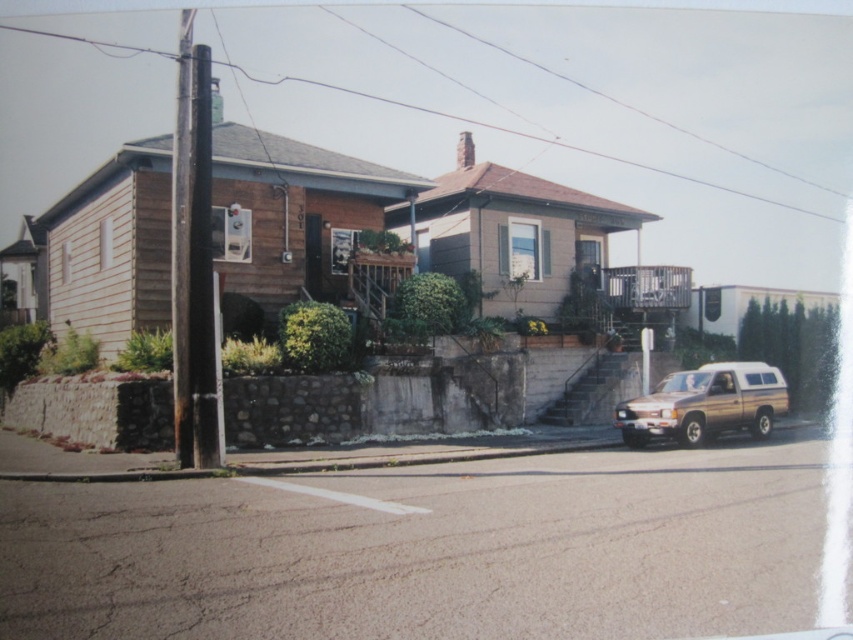
How far apart are gold metallic van at lower right and brown wooden power line at upper center?

gold metallic van at lower right is 237.28 feet from brown wooden power line at upper center.

Does point (706, 387) come closer to viewer compared to point (151, 49)?

That is True.

Find the location of a particular element. gold metallic van at lower right is located at coordinates (705, 404).